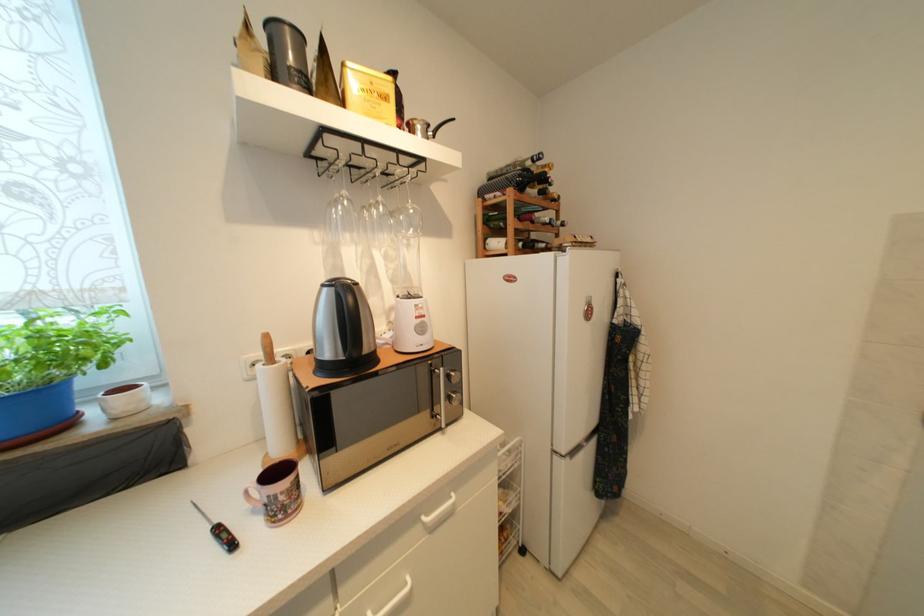
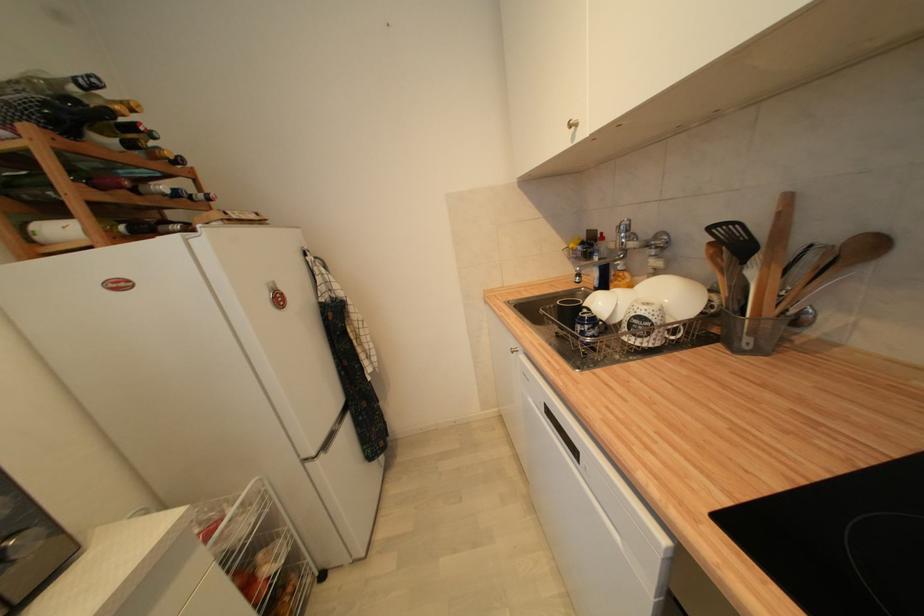
In the second image, find the point that corresponds to (562,201) in the first image.

(186, 164)